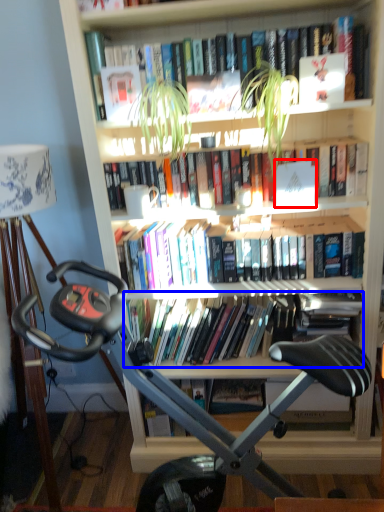
Question: Among these objects, which one is nearest to the camera, paperback book (highlighted by a red box) or book (highlighted by a blue box)?

Choices:
 (A) paperback book
 (B) book

Answer: (A)